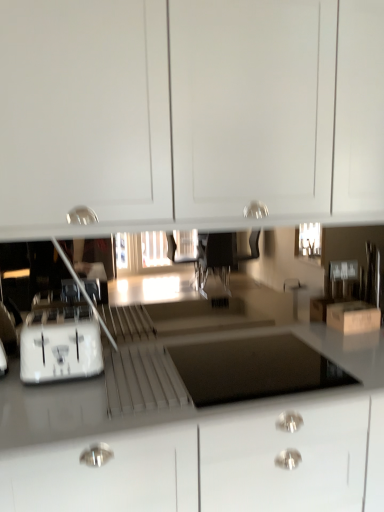
Question: Does brown cardboard box at lower right lie behind white plastic drawer at center?

Choices:
 (A) no
 (B) yes

Answer: (B)

Question: From the image's perspective, is brown cardboard box at lower right on top of white plastic drawer at center?

Choices:
 (A) no
 (B) yes

Answer: (B)

Question: Is brown cardboard box at lower right oriented towards white plastic drawer at center?

Choices:
 (A) yes
 (B) no

Answer: (B)

Question: Is brown cardboard box at lower right completely or partially outside of white plastic drawer at center?

Choices:
 (A) yes
 (B) no

Answer: (A)

Question: Is brown cardboard box at lower right shorter than white plastic drawer at center?

Choices:
 (A) yes
 (B) no

Answer: (B)

Question: In the image, is white plastic drawer at center positioned in front of or behind brown cardboard box at lower right?

Choices:
 (A) behind
 (B) front

Answer: (B)

Question: From the image's perspective, is white plastic drawer at center located above or below brown cardboard box at lower right?

Choices:
 (A) above
 (B) below

Answer: (B)

Question: Is white plastic drawer at center taller or shorter than brown cardboard box at lower right?

Choices:
 (A) short
 (B) tall

Answer: (A)

Question: In terms of size, does white plastic drawer at center appear bigger or smaller than brown cardboard box at lower right?

Choices:
 (A) big
 (B) small

Answer: (A)

Question: Looking at the image, does brown cardboard box at lower right seem bigger or smaller compared to white plastic toaster at lower left?

Choices:
 (A) small
 (B) big

Answer: (A)

Question: Do you think brown cardboard box at lower right is within white plastic toaster at lower left, or outside of it?

Choices:
 (A) inside
 (B) outside

Answer: (B)

Question: From the image's perspective, is brown cardboard box at lower right positioned above or below white plastic toaster at lower left?

Choices:
 (A) below
 (B) above

Answer: (B)

Question: From a real-world perspective, is brown cardboard box at lower right above or below white plastic toaster at lower left?

Choices:
 (A) below
 (B) above

Answer: (A)

Question: Considering the positions of white plastic drawer at center and white glossy cabinet at upper center in the image, is white plastic drawer at center taller or shorter than white glossy cabinet at upper center?

Choices:
 (A) short
 (B) tall

Answer: (A)

Question: In the image, is white plastic drawer at center positioned in front of or behind white glossy cabinet at upper center?

Choices:
 (A) front
 (B) behind

Answer: (B)